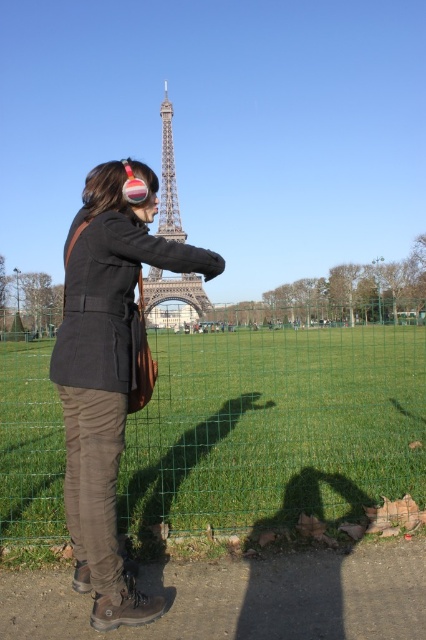
You are a photographer trying to capture a photo of the Eiffel Tower. You notice a person wearing a matte black jacket at center and the metallic silver Eiffel Tower at center in your frame. Since the jacket is blocking the view of the tower, can you adjust your position so that the jacket no longer covers the tower?

The matte black jacket at center is taller than the metallic silver eiffel tower at center, so adjusting your position might not help as the jacket is closer and taller, likely still blocking the tower unless moving to the side or further back.

You are a photographer planning to take a photo of the metallic silver Eiffel Tower at center and the green wire mesh fence at center. Based on their sizes in the image, which object should you focus on if you want to capture the larger one in your shot?

The green wire mesh fence at center is larger in size than the metallic silver Eiffel Tower at center, so you should focus on the green wire mesh fence at center to capture the larger object.